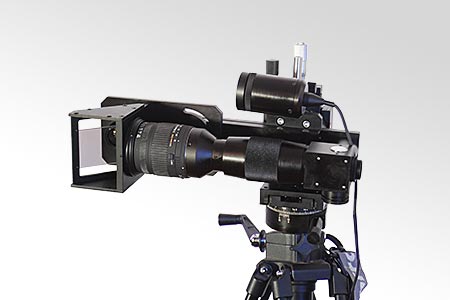
Image resolution: width=450 pixels, height=300 pixels. What are the coordinates of `led illuminator` in the screenshot? It's located at (266, 94).